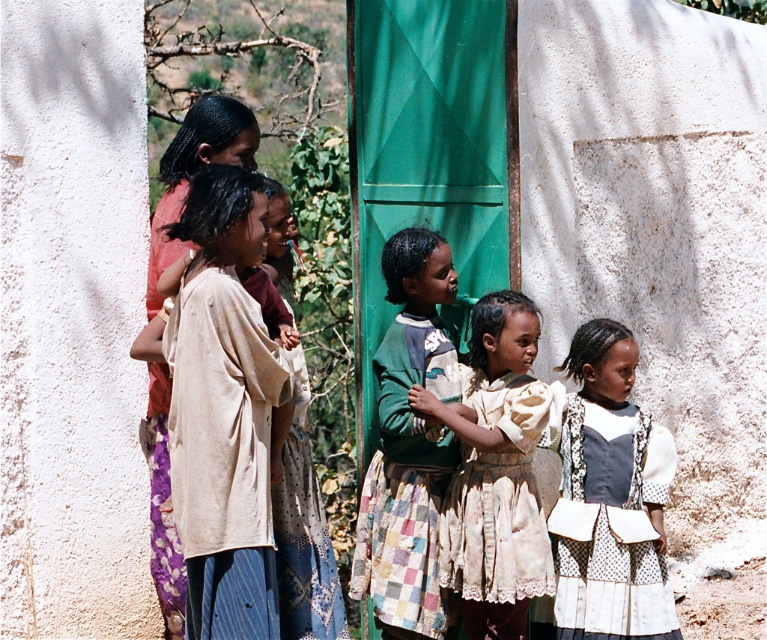
Question: Among these objects, which one is farthest from the camera?

Choices:
 (A) white dotted dress at center
 (B) multicolored patchwork skirt at center

Answer: (A)

Question: Which object is positioned closest to the multicolored patchwork skirt at center?

Choices:
 (A) beige fabric dress at left
 (B) light beige lace dress at center
 (C) white dotted dress at center

Answer: (B)

Question: Is light beige lace dress at center thinner than multicolored patchwork skirt at center?

Choices:
 (A) yes
 (B) no

Answer: (B)

Question: Is white dotted dress at center smaller than light beige lace dress at center?

Choices:
 (A) no
 (B) yes

Answer: (B)

Question: Which of these objects is positioned farthest from the beige fabric dress at left?

Choices:
 (A) white dotted dress at center
 (B) light beige lace dress at center
 (C) multicolored patchwork skirt at center

Answer: (A)

Question: Is multicolored patchwork skirt at center above beige fabric dress at left?

Choices:
 (A) no
 (B) yes

Answer: (A)